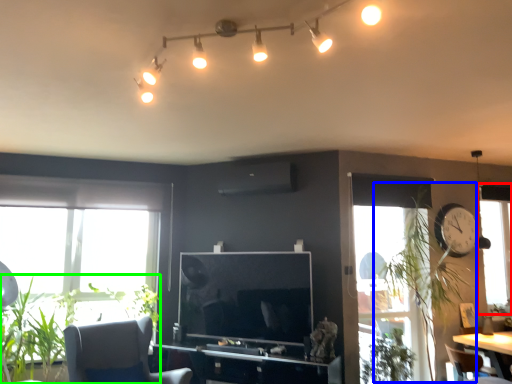
Question: Which object is the closest to the window (highlighted by a red box)? Choose among these: plant (highlighted by a blue box) or plant (highlighted by a green box).

Choices:
 (A) plant
 (B) plant

Answer: (A)